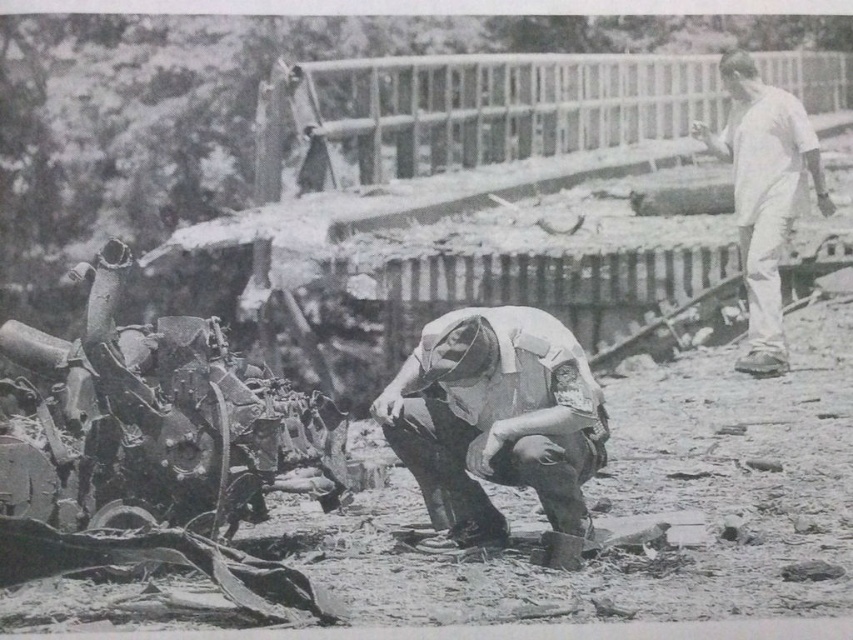
You are a photographer trying to capture the rusty metal tank at lower left and the white cotton shirt at upper right in a single frame. Which object should you focus on first to ensure both are in focus?

The rusty metal tank at lower left is closer to the viewer than the white cotton shirt at upper right. To ensure both are in focus, you should focus on the rusty metal tank at lower left first, as it is the closer object.

You are a rescue worker trying to reach the white fabric uniform at center. There is a rusty metal tank at lower left blocking your path. Can you walk around it to the right side?

The rusty metal tank at lower left is positioned on the left side of white fabric uniform at center, so you can walk around it to the right side to reach the white fabric uniform at center.

You are a rescue worker assessing the scene. You see the rusty metal tank at lower left and the white fabric uniform at center. Which object is taller?

The rusty metal tank at lower left is taller than the white fabric uniform at center.